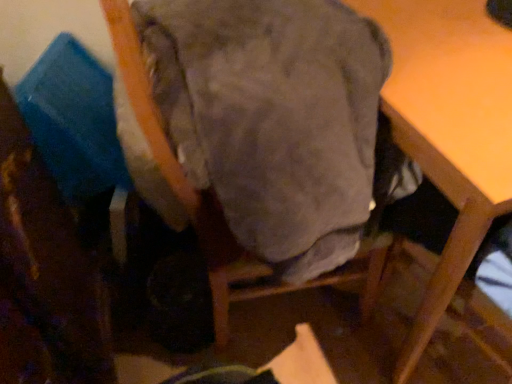
Question: Choose the correct answer: Is velvet-like fabric chair at center inside wooden table at upper right or outside it?

Choices:
 (A) inside
 (B) outside

Answer: (B)

Question: Considering the positions of velvet-like fabric chair at center and wooden table at upper right in the image, is velvet-like fabric chair at center wider or thinner than wooden table at upper right?

Choices:
 (A) thin
 (B) wide

Answer: (A)

Question: In the image, is velvet-like fabric chair at center positioned in front of or behind wooden table at upper right?

Choices:
 (A) front
 (B) behind

Answer: (A)

Question: In terms of height, does wooden table at upper right look taller or shorter compared to velvet-like fabric chair at center?

Choices:
 (A) tall
 (B) short

Answer: (B)

Question: From the image's perspective, is wooden table at upper right positioned above or below velvet-like fabric chair at center?

Choices:
 (A) below
 (B) above

Answer: (B)

Question: Is point (426, 319) positioned closer to the camera than point (366, 188)?

Choices:
 (A) closer
 (B) farther

Answer: (B)

Question: Considering the positions of wooden table at upper right and velvet-like fabric chair at center in the image, is wooden table at upper right bigger or smaller than velvet-like fabric chair at center?

Choices:
 (A) small
 (B) big

Answer: (B)